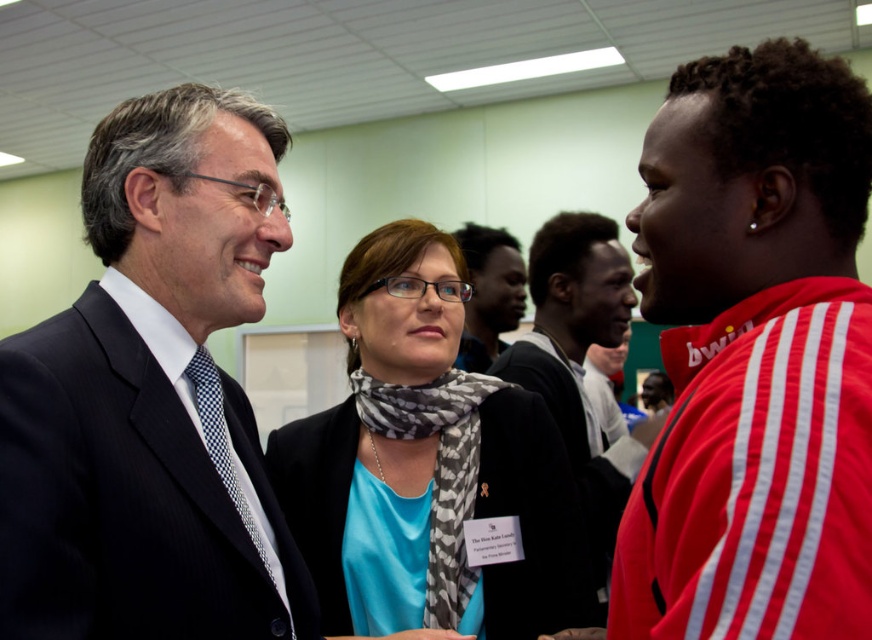
Question: Which object appears closest to the camera in this image?

Choices:
 (A) red fabric shirt at right
 (B) blue fabric scarf at center
 (C) matte black suit at center

Answer: (A)

Question: In this image, where is dark blue suit at center located relative to matte black suit at center?

Choices:
 (A) below
 (B) above

Answer: (A)

Question: Does red fabric shirt at right have a smaller size compared to dark skin textured face at center?

Choices:
 (A) yes
 (B) no

Answer: (A)

Question: Estimate the real-world distances between objects in this image. Which object is farther from the dark blue suit at center?

Choices:
 (A) dark skin textured face at center
 (B) blue fabric scarf at center
 (C) matte black suit at center

Answer: (C)

Question: In this image, where is red fabric shirt at right located relative to dark blue suit at center?

Choices:
 (A) below
 (B) above

Answer: (B)

Question: Which point is farther to the camera?

Choices:
 (A) blue fabric scarf at center
 (B) matte black suit at center

Answer: (B)